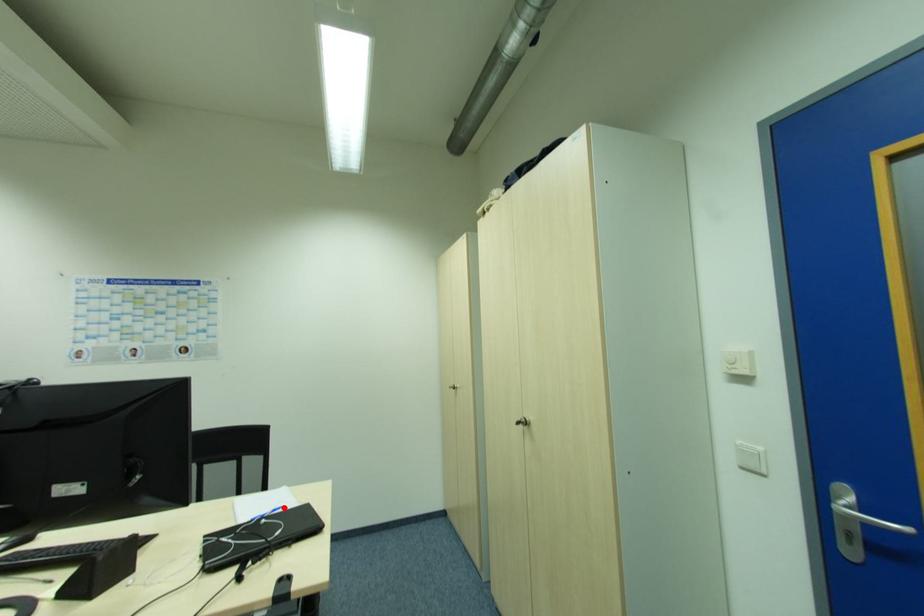
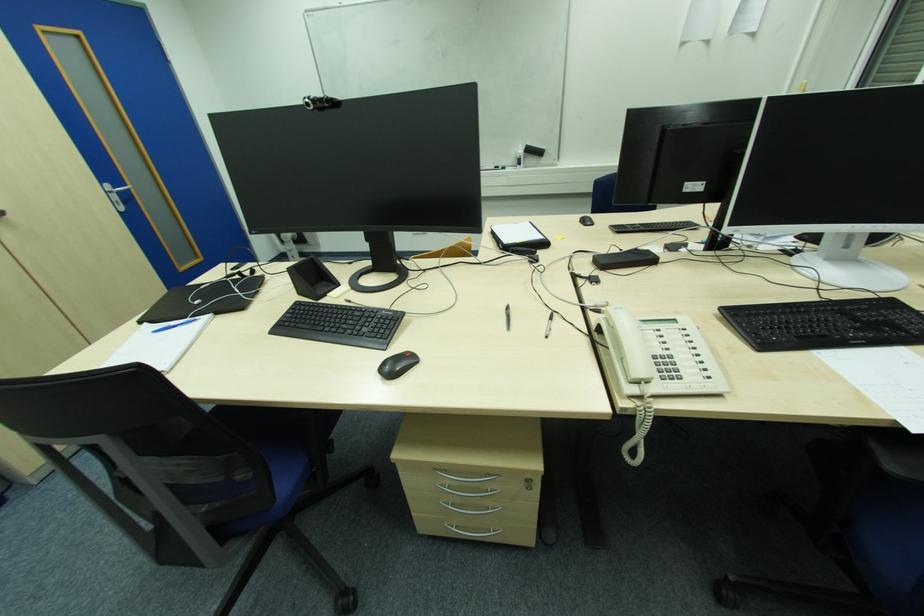
Find the pixel in the second image that matches the highlighted location in the first image.

(156, 333)